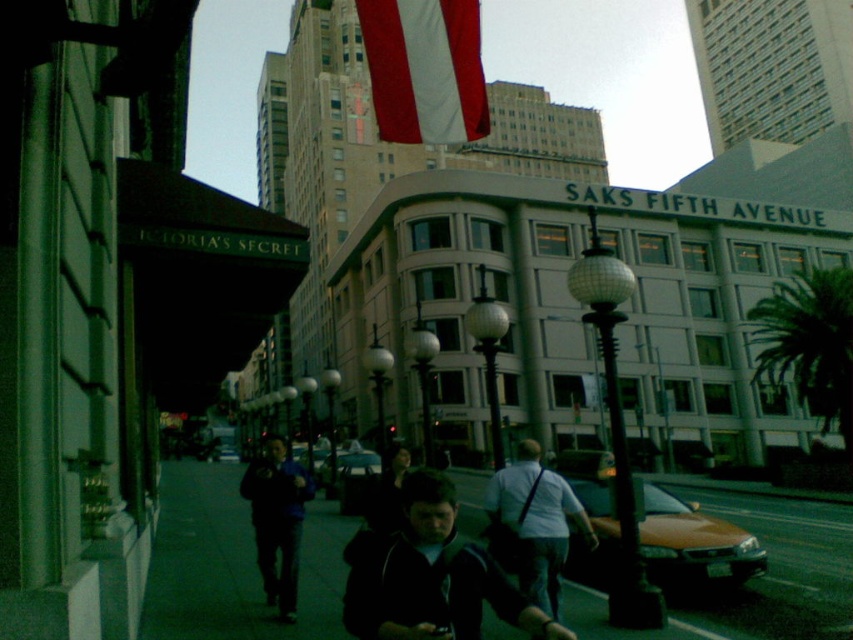
Question: Observing the image, what is the correct spatial positioning of dark gray asphalt at lower center in reference to dark blue jacket at center?

Choices:
 (A) above
 (B) below

Answer: (B)

Question: Among these objects, which one is farthest from the camera?

Choices:
 (A) light blue jeans at center
 (B) dark gray asphalt at lower center
 (C) blue fabric jacket at center
 (D) red/white striped fabric at upper center

Answer: (C)

Question: Considering the real-world distances, which object is closest to the dark gray asphalt at lower center?

Choices:
 (A) red/white striped fabric at upper center
 (B) blue fabric jacket at center

Answer: (B)

Question: Can you confirm if dark blue jacket at center is smaller than red/white striped fabric at upper center?

Choices:
 (A) no
 (B) yes

Answer: (A)

Question: Which object is positioned closest to the dark blue jacket at center?

Choices:
 (A) dark gray asphalt at lower center
 (B) red/white striped fabric at upper center

Answer: (B)

Question: Does dark blue jacket at center have a smaller size compared to blue fabric jacket at center?

Choices:
 (A) yes
 (B) no

Answer: (A)